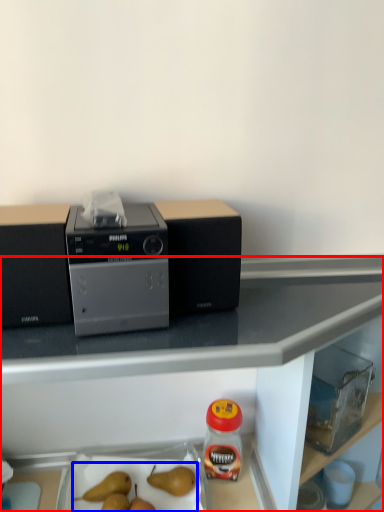
Question: Which of the following is the farthest to the observer, table (highlighted by a red box) or fruit (highlighted by a blue box)?

Choices:
 (A) table
 (B) fruit

Answer: (B)